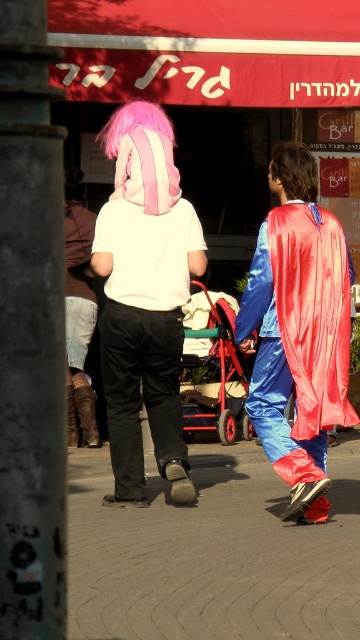
You are a delivery person trying to place a metallic red baby carriage at center on the gray concrete pavement at center. Based on the scene, will the carriage fit entirely on the pavement?

The gray concrete pavement at center has a larger width than the metallic red baby carriage at center, so the carriage will fit entirely on the pavement.

You are a photographer trying to capture a closeup of the metallic red baby carriage at center. The gray concrete pavement at center is in the way. Can you lower your camera to get the shot?

The gray concrete pavement at center has a lesser height compared to metallic red baby carriage at center. Lowering the camera might allow you to capture the baby carriage without the pavement obstructing the view, as the pavement is lower than the carriage.

Consider the image. You are a photographer trying to capture a closeup of the shiny blue cape at center and the leather boots at lower left. Which object would require you to zoom in more to fill the frame?

The leather boots at lower left would require more zooming in because the shiny blue cape at center is wider than the leather boots at lower left, meaning the cape takes up more space in the frame naturally.